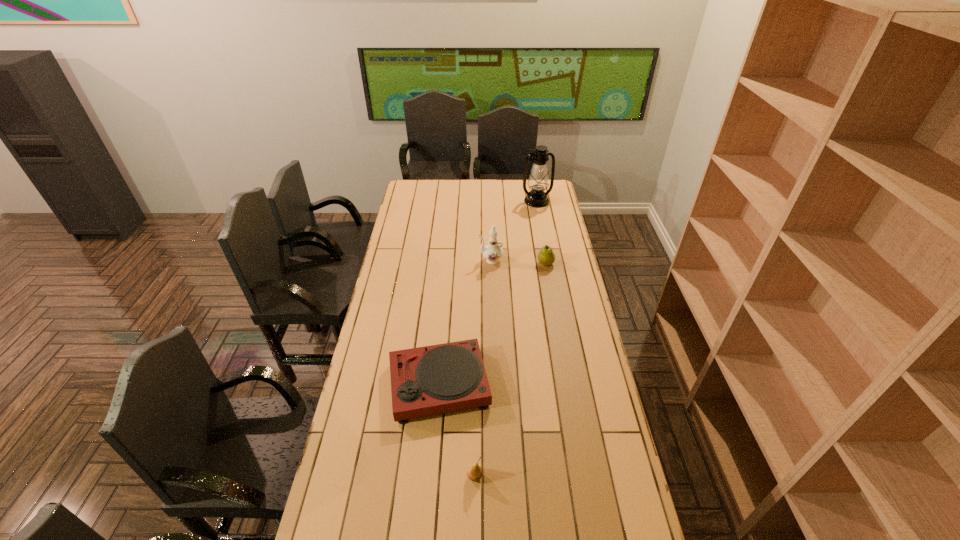
In the image, there is a desktop. Identify the location of vacant space at the left edge. (382, 463).

Find the location of a particular element. vacant space at the right edge of the desktop is located at coordinates (568, 446).

This screenshot has width=960, height=540. In order to click on vacant area at the far left corner of the desktop in this screenshot , I will do (x=410, y=194).

Where is `unoccupied area between the taller pear and the oil lamp`? unoccupied area between the taller pear and the oil lamp is located at coordinates (541, 232).

The width and height of the screenshot is (960, 540). What are the coordinates of `free area in between the right pear and the nearest object` in the screenshot? It's located at (510, 370).

The width and height of the screenshot is (960, 540). In order to click on empty location between the record player and the taller pear in this screenshot , I will do pos(492,324).

The height and width of the screenshot is (540, 960). In order to click on vacant space that is in between the nearer pear and the fourth farthest object in this screenshot , I will do `click(457, 430)`.

I want to click on free space that is in between the farther pear and the shorter pear, so click(510, 370).

Locate an element on the screen. This screenshot has width=960, height=540. vacant space in between the left pear and the tallest object is located at coordinates (506, 339).

Image resolution: width=960 pixels, height=540 pixels. Find the location of `vacant space that's between the second nearest object and the right pear`. vacant space that's between the second nearest object and the right pear is located at coordinates (492, 324).